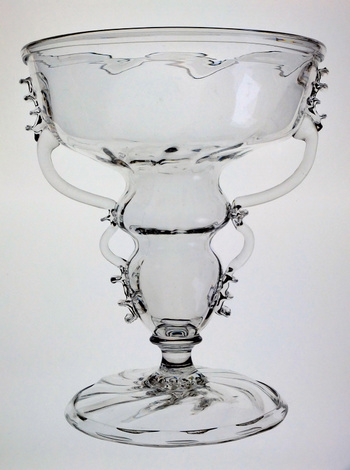
Where is `glass`? The height and width of the screenshot is (470, 350). glass is located at coordinates (131, 104), (291, 181), (165, 419), (132, 430).